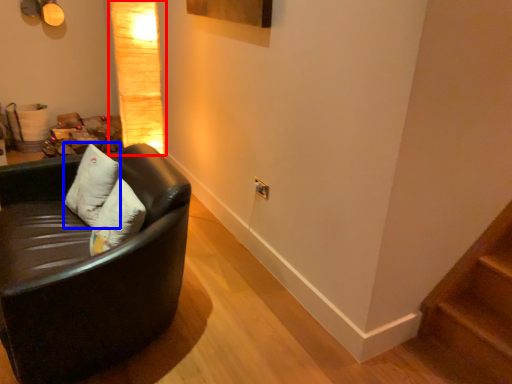
Question: Which of the following is the farthest to the observer, lamp (highlighted by a red box) or pillow (highlighted by a blue box)?

Choices:
 (A) lamp
 (B) pillow

Answer: (A)